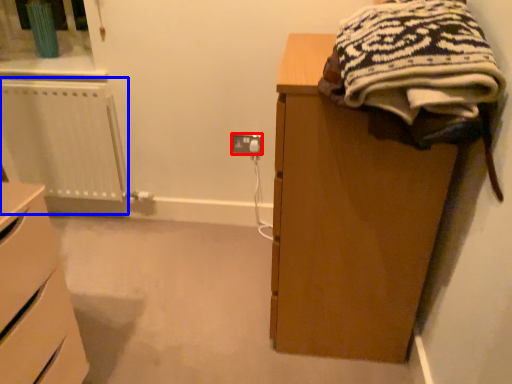
Question: Which object appears closest to the camera in this image, electric outlet (highlighted by a red box) or radiator (highlighted by a blue box)?

Choices:
 (A) electric outlet
 (B) radiator

Answer: (B)